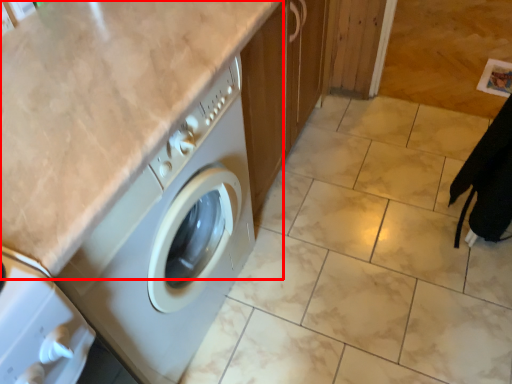
Question: From the image's perspective, what is the correct spatial relationship of counter top (annotated by the red box) in relation to granite?

Choices:
 (A) below
 (B) above

Answer: (A)